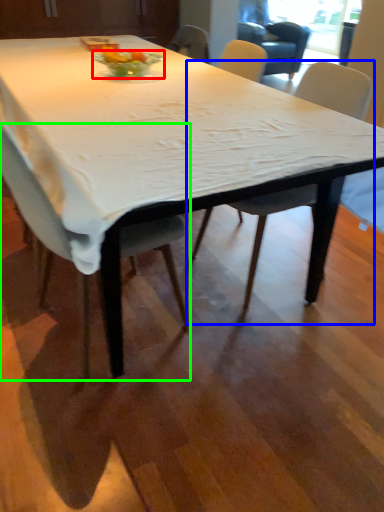
Question: Estimate the real-world distances between objects in this image. Which object is closer to glass bowl (highlighted by a red box), chair (highlighted by a blue box) or chair (highlighted by a green box)?

Choices:
 (A) chair
 (B) chair

Answer: (A)